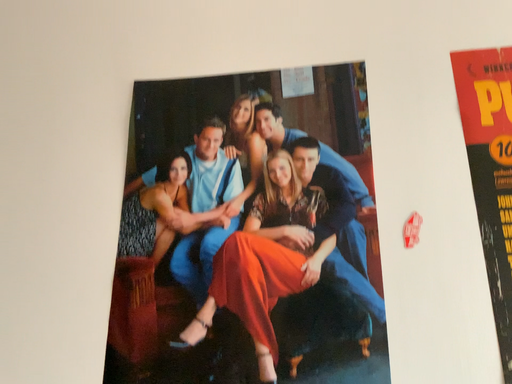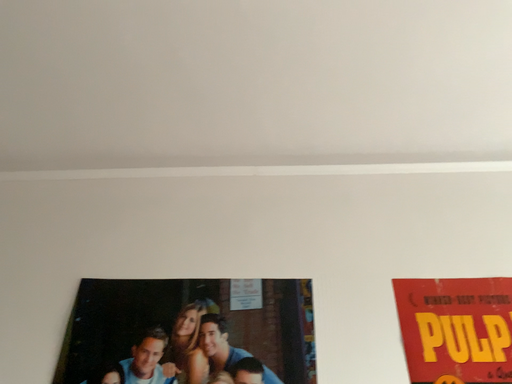
Question: Which way did the camera rotate in the video?

Choices:
 (A) rotated upward
 (B) rotated downward

Answer: (A)